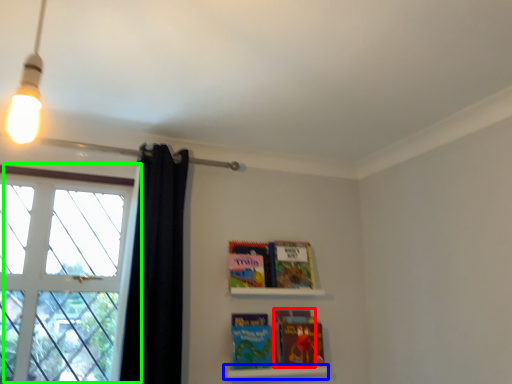
Question: Based on their relative distances, which object is nearer to paperback book (highlighted by a red box)? Choose from shelf (highlighted by a blue box) and window (highlighted by a green box).

Choices:
 (A) shelf
 (B) window

Answer: (A)